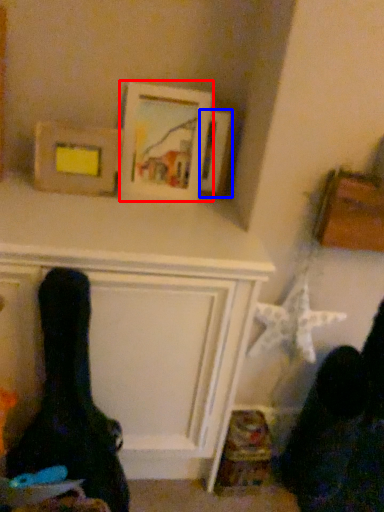
Question: Which object is further to the camera taking this photo, picture frame (highlighted by a red box) or picture frame (highlighted by a blue box)?

Choices:
 (A) picture frame
 (B) picture frame

Answer: (B)